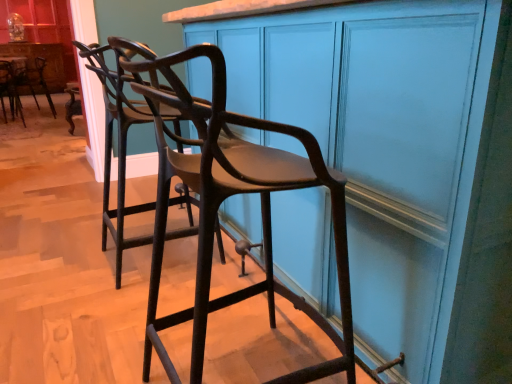
Question: Can you confirm if matte wood cabinet at center, which appears as the 1th cabinetry when viewed from the right, is thinner than matte black bar stool at left, the 3th chair positioned from the right?

Choices:
 (A) yes
 (B) no

Answer: (B)

Question: From the image's perspective, is matte wood cabinet at center, which appears as the 1th cabinetry when viewed from the right, located beneath matte black bar stool at left, which is the 1th chair from top to bottom?

Choices:
 (A) yes
 (B) no

Answer: (A)

Question: From a real-world perspective, is matte wood cabinet at center, placed as the 2th cabinetry when sorted from top to bottom, located beneath matte black bar stool at left, which ranks as the 3th chair in front-to-back order?

Choices:
 (A) no
 (B) yes

Answer: (A)

Question: Is matte wood cabinet at center, acting as the 1th cabinetry starting from the bottom, in contact with matte black bar stool at left, the 1th chair when ordered from left to right?

Choices:
 (A) no
 (B) yes

Answer: (A)

Question: Can you confirm if matte wood cabinet at center, the second cabinetry from the left, is smaller than matte black bar stool at left, the 3th chair positioned from the right?

Choices:
 (A) no
 (B) yes

Answer: (A)

Question: Does matte wood cabinet at center, acting as the 1th cabinetry starting from the bottom, contain matte black bar stool at left, the 1th chair when ordered from left to right?

Choices:
 (A) no
 (B) yes

Answer: (A)

Question: Considering the relative sizes of matte black bar stool at left, which appears as the 2th chair when ordered from the bottom, and matte black bar stool at left, the third chair in the bottom-to-top sequence, in the image provided, is matte black bar stool at left, which appears as the 2th chair when ordered from the bottom, shorter than matte black bar stool at left, the third chair in the bottom-to-top sequence,?

Choices:
 (A) no
 (B) yes

Answer: (A)

Question: Considering the relative sizes of matte black bar stool at left, which appears as the 2th chair when ordered from the bottom, and matte black bar stool at left, acting as the first chair starting from the back, in the image provided, is matte black bar stool at left, which appears as the 2th chair when ordered from the bottom, bigger than matte black bar stool at left, acting as the first chair starting from the back,?

Choices:
 (A) no
 (B) yes

Answer: (A)

Question: From the image's perspective, does matte black bar stool at left, which appears as the 2th chair when viewed from the back, appear lower than matte black bar stool at left, the third chair in the bottom-to-top sequence?

Choices:
 (A) yes
 (B) no

Answer: (A)

Question: Can you see matte black bar stool at left, which appears as the 2th chair when viewed from the back, touching matte black bar stool at left, the 1th chair when ordered from left to right?

Choices:
 (A) yes
 (B) no

Answer: (A)

Question: From a real-world perspective, is matte black bar stool at left, the second chair viewed from the left, on top of matte black bar stool at left, which is the 1th chair from top to bottom?

Choices:
 (A) yes
 (B) no

Answer: (A)

Question: Is matte brown wood chair at center, marked as the third chair in a top-to-bottom arrangement, oriented away from matte wood cabinet at center, placed as the 2th cabinetry when sorted from top to bottom?

Choices:
 (A) no
 (B) yes

Answer: (A)